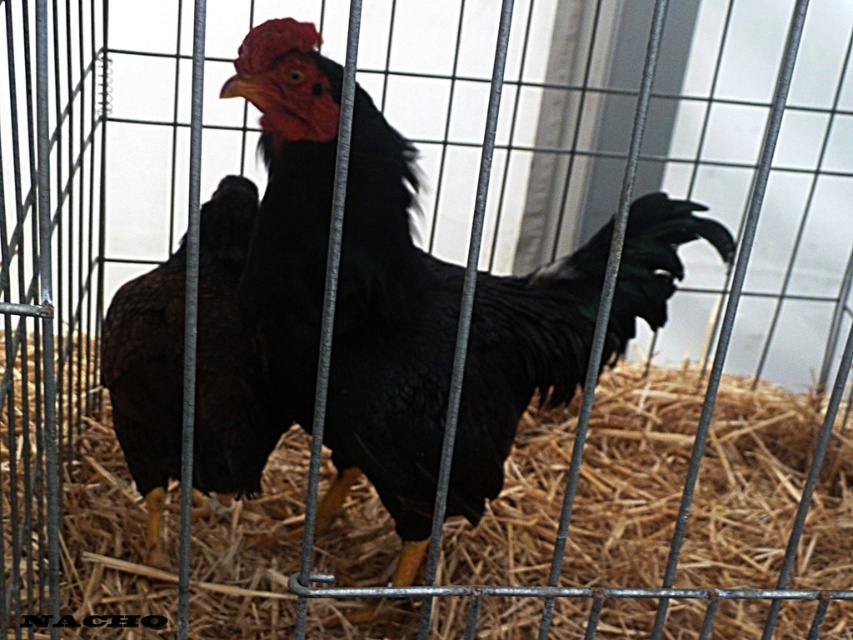
You are a farmer who wants to check the condition of the brown feathered chicken at center. To do that, you need to reach under it to feel the temperature of the brown straw at center. Is the straw accessible from your current position outside the cage?

The brown straw at center is positioned under the brown feathered chicken at center, so you can access the brown straw at center by reaching under the chicken from outside the cage.

Consider the image. You are a farmer checking the cage of your chicken. You notice the brown straw at center and the brown feathered chicken at center. Which object is taller?

The brown straw at center is shorter than the brown feathered chicken at center, so the brown feathered chicken at center is taller.

You are a bird that wants to land on the brown straw at center. Based on the image, what is the exact 2D coordinate where you should aim to land?

The exact 2D coordinate where the brown straw at center is located is at point (630, 492), so you should aim for that point to land on it.